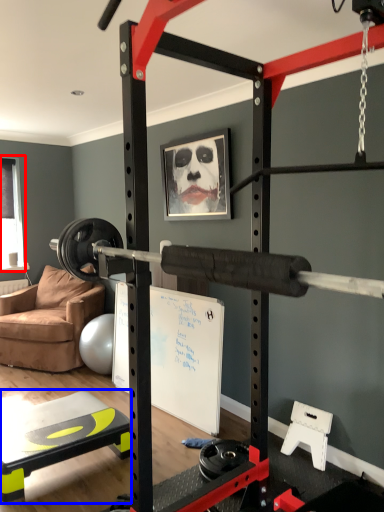
Question: Which object is further to the camera taking this photo, window screen (highlighted by a red box) or table (highlighted by a blue box)?

Choices:
 (A) window screen
 (B) table

Answer: (A)